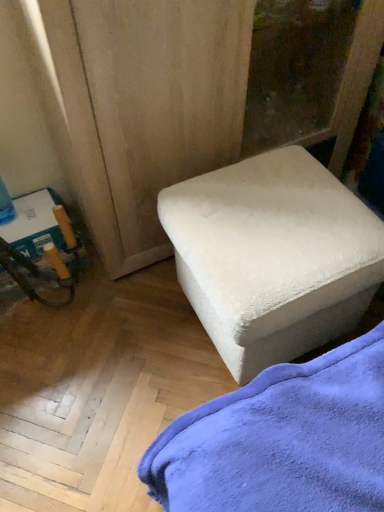
Describe the element at coordinates (272, 256) in the screenshot. I see `white fabric ottoman at center` at that location.

I want to click on white fabric ottoman at center, so click(x=272, y=256).

I want to click on white fabric ottoman at center, so click(272, 256).